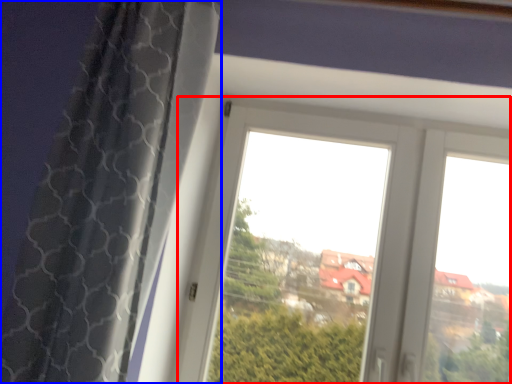
Question: Which object is closer to the camera taking this photo, window (highlighted by a red box) or curtain (highlighted by a blue box)?

Choices:
 (A) window
 (B) curtain

Answer: (B)